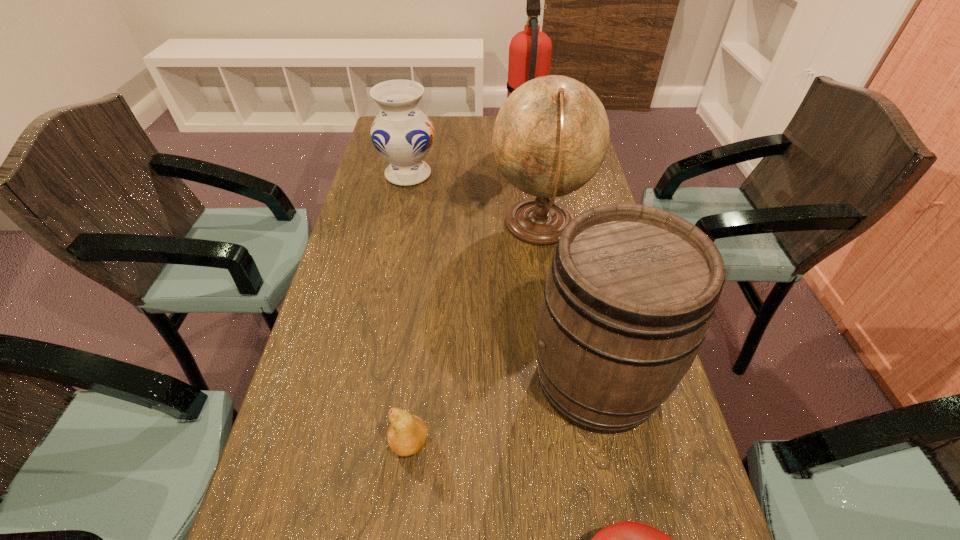
You are a GUI agent. You are given a task and a screenshot of the screen. Output one action in this format:
    pyautogui.click(x=<x>, y=<y>)
    Task: Click on the vacant space at the left edge of the desktop
    The width and height of the screenshot is (960, 540).
    Given the screenshot: What is the action you would take?
    pyautogui.click(x=384, y=179)

What are the coordinates of `blank region between the pear and the third shortest object` in the screenshot? It's located at (409, 309).

Locate an element on the screen. vacant area that lies between the second shortest object and the fire extinguisher is located at coordinates (467, 294).

Select which object is the closest to the nearest object. Please provide its 2D coordinates. Your answer should be formatted as a tuple, i.e. [(x, y)], where the tuple contains the x and y coordinates of a point satisfying the conditions above.

[(628, 300)]

Image resolution: width=960 pixels, height=540 pixels. Find the location of `object that is the nearest to the fourth nearest object`. object that is the nearest to the fourth nearest object is located at coordinates (403, 135).

I want to click on free location that satisfies the following two spatial constraints: 1. at the nozzle of the fire extinguisher; 2. on the front side of the third shortest object, so click(x=527, y=174).

What are the coordinates of `vacant space that satisfies the following two spatial constraints: 1. at the nozzle of the fire extinguisher; 2. on the back side of the third tallest object` in the screenshot? It's located at (555, 379).

Find the location of a particular element. This screenshot has height=540, width=960. free space that satisfies the following two spatial constraints: 1. on the front-facing side of the third farthest object; 2. on the left side of the third tallest object is located at coordinates (563, 379).